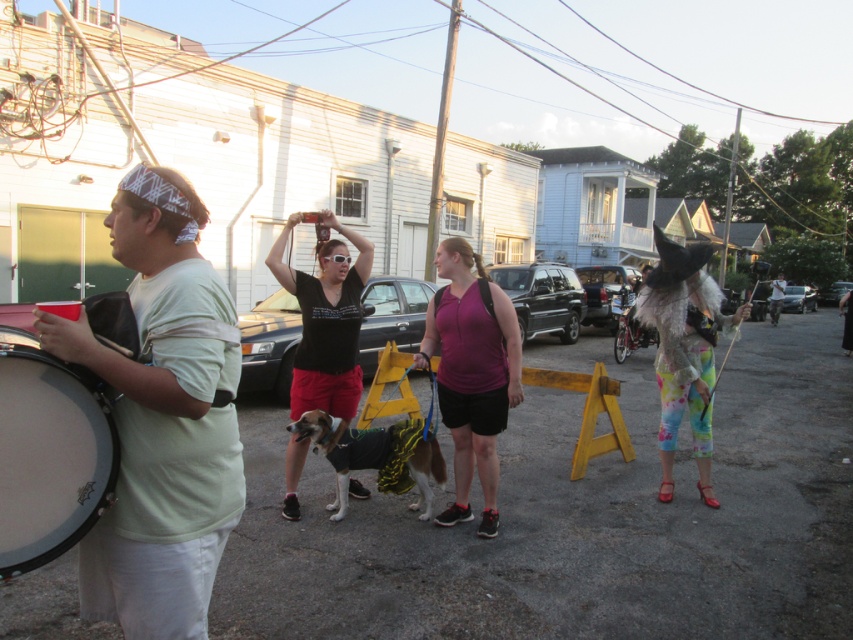
Question: Which object appears farthest from the camera in this image?

Choices:
 (A) tie-dye fabric pants at right
 (B) purple matte shirt at center

Answer: (A)

Question: Observing the image, what is the correct spatial positioning of matte white t-shirt at left in reference to tie-dye fabric pants at right?

Choices:
 (A) right
 (B) left

Answer: (B)

Question: Among these points, which one is nearest to the camera?

Choices:
 (A) (672, 316)
 (B) (445, 356)
 (C) (39, 474)
 (D) (316, 339)

Answer: (C)

Question: Is matte black drum at left positioned behind purple matte shirt at center?

Choices:
 (A) yes
 (B) no

Answer: (B)

Question: Among these points, which one is nearest to the camera?

Choices:
 (A) (9, 518)
 (B) (473, 381)
 (C) (125, 397)
 (D) (683, 282)

Answer: (A)

Question: Is purple matte shirt at center smaller than tie-dye fabric pants at right?

Choices:
 (A) no
 (B) yes

Answer: (A)